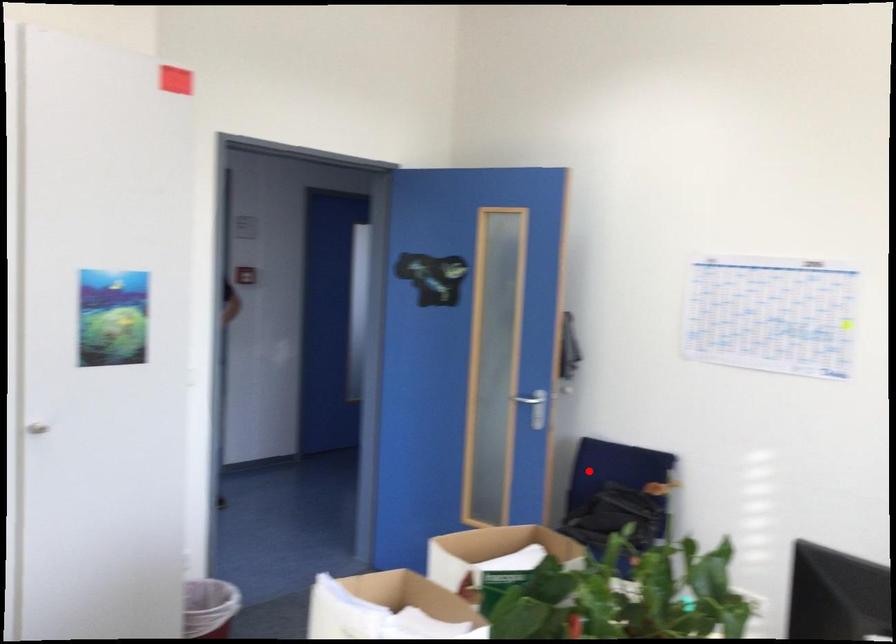
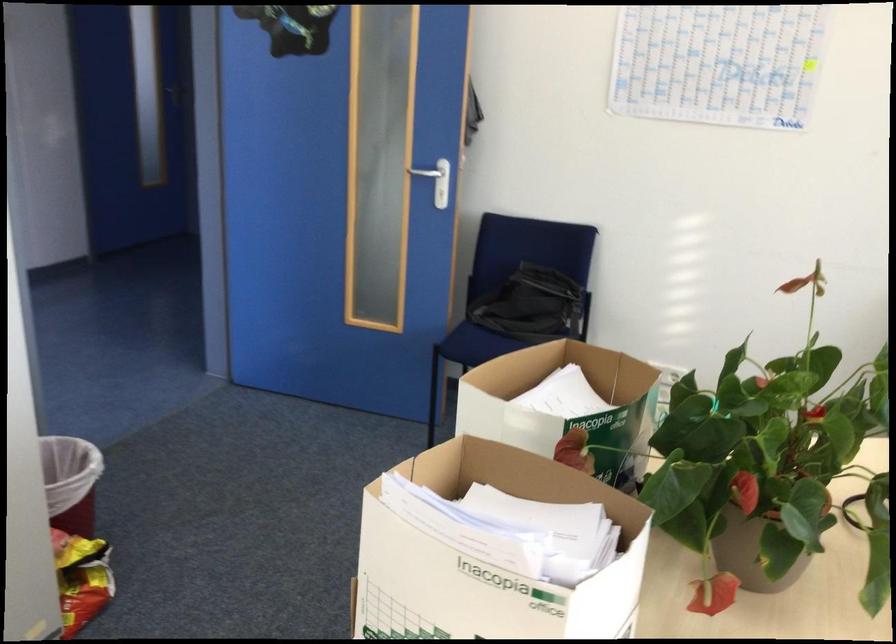
Question: I am providing you with two images of the same scene from different viewpoints. In image1, a red point is highlighted. Considering the same 3D point in image2, which of the following is correct?

Choices:
 (A) It is closer
 (B) It is farther

Answer: (A)